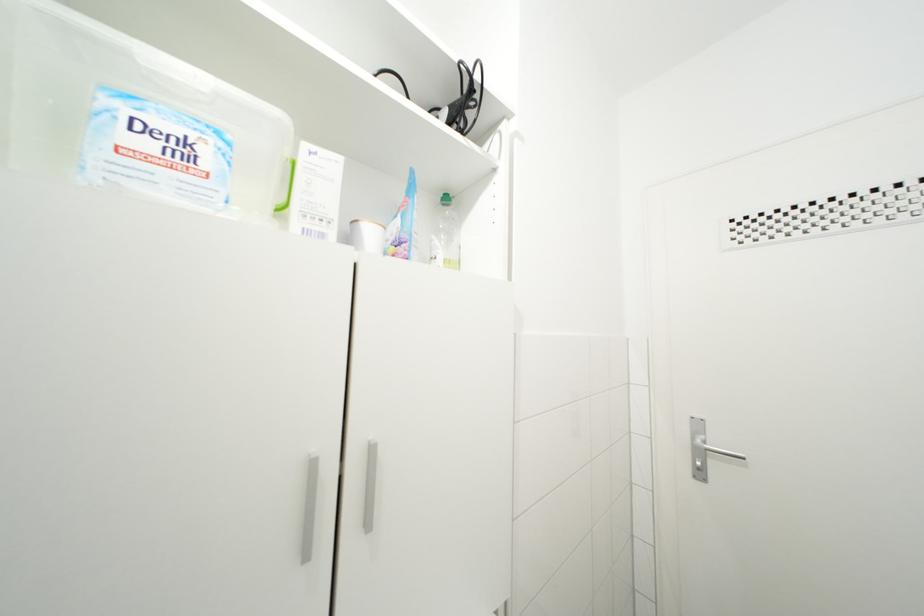
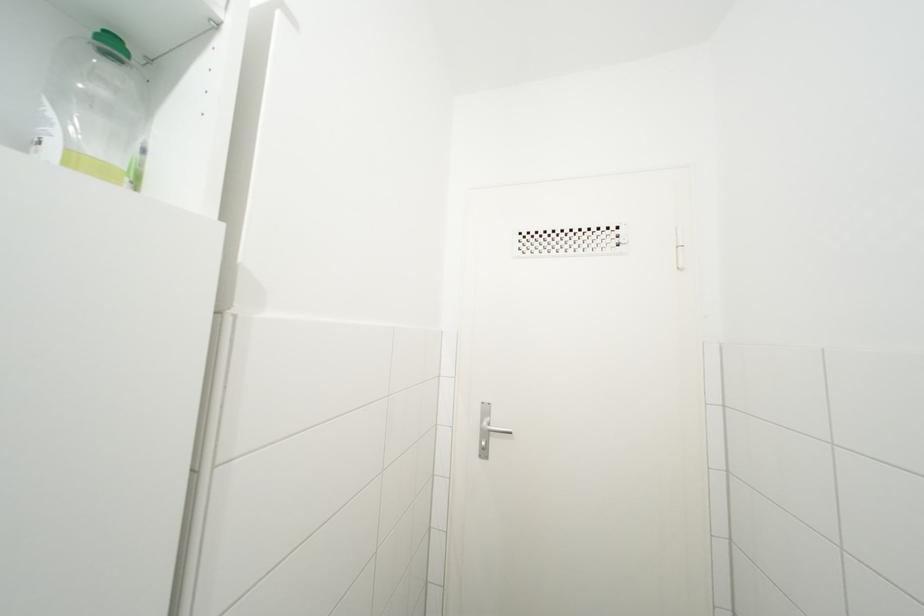
Question: How did the camera likely rotate?

Choices:
 (A) Left
 (B) Right
 (C) Up
 (D) Down

Answer: (B)